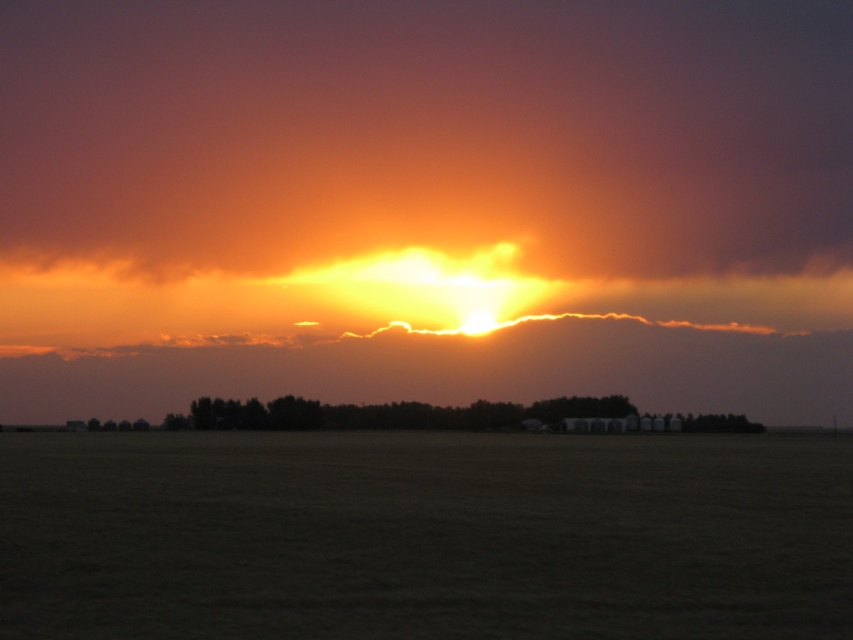
Which is in front, point (352, 566) or point (842, 269)?

Positioned in front is point (352, 566).

Which is behind, point (91, 628) or point (805, 275)?

The point (805, 275) is behind.

At what (x,y) coordinates should I click in order to perform the action: click on dark brown grass at center. Please return your answer as a coordinate pair (x, y). This screenshot has height=640, width=853. Looking at the image, I should click on 424,536.